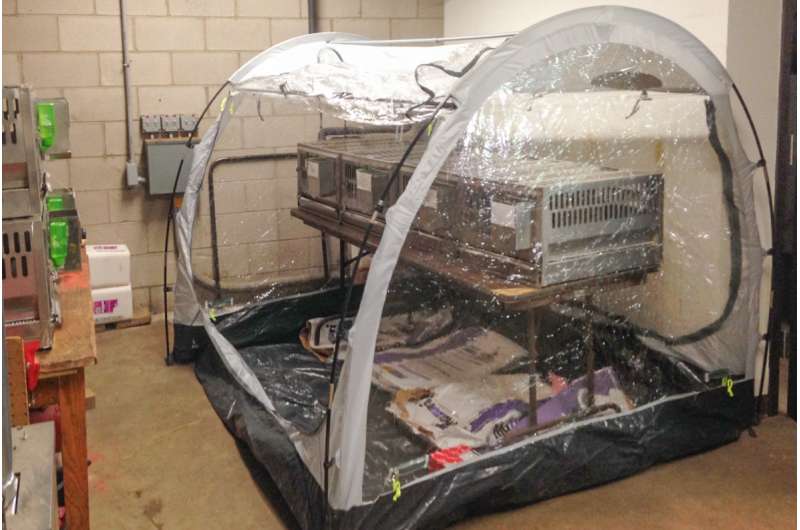
The height and width of the screenshot is (530, 800). Find the location of `table`. table is located at coordinates (86, 334).